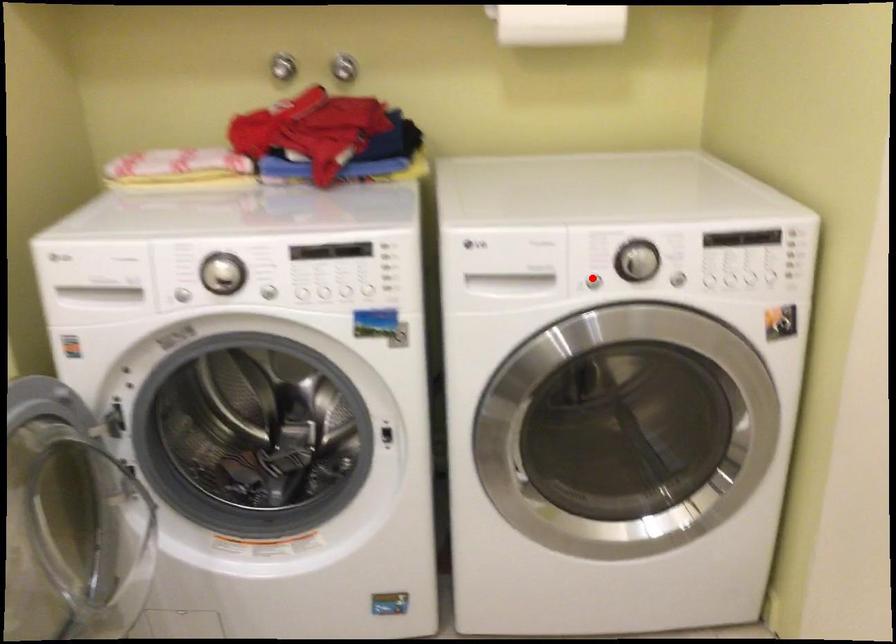
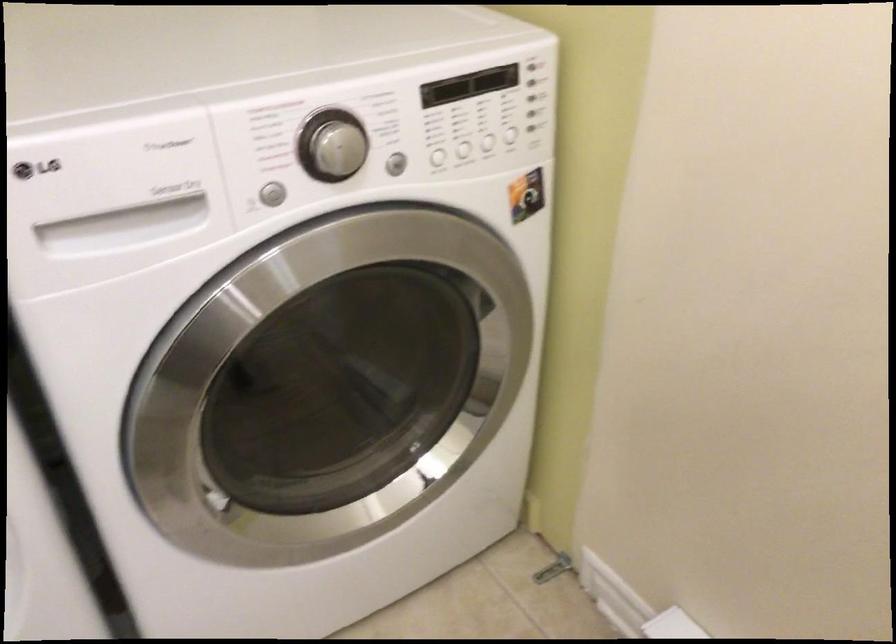
The point at the highlighted location is marked in the first image. Where is the corresponding point in the second image?

(269, 194)